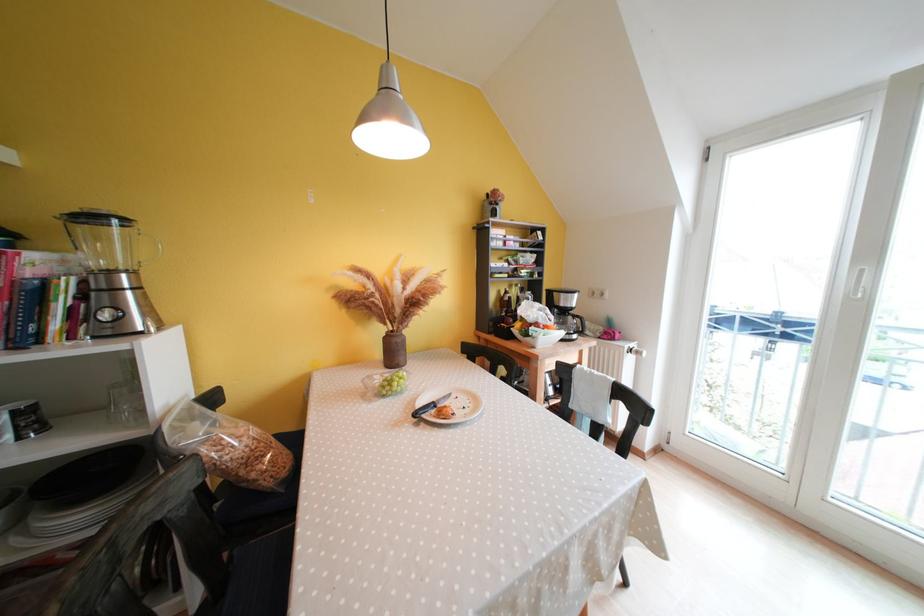
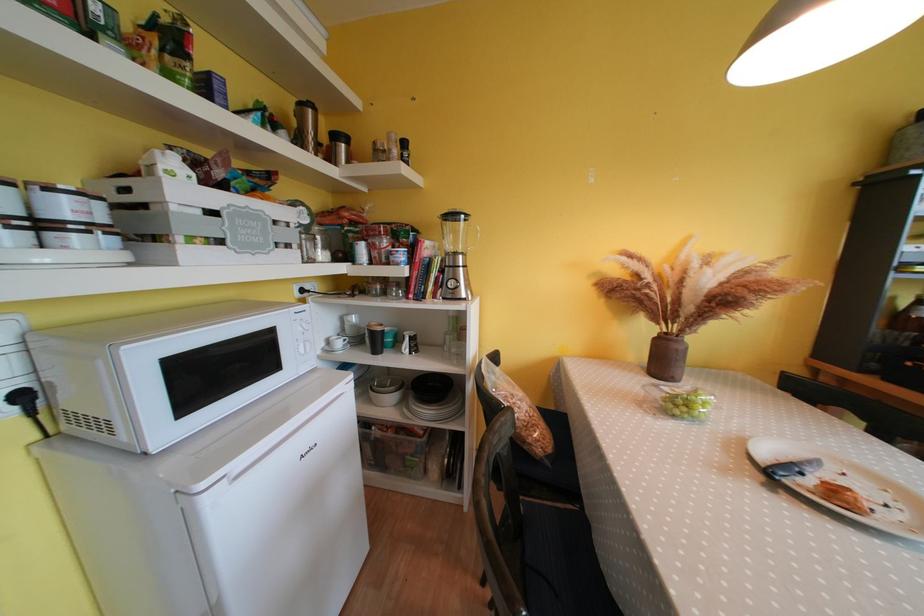
Question: The first image is from the beginning of the video and the second image is from the end. How did the camera likely rotate when shooting the video?

Choices:
 (A) Left
 (B) Right
 (C) Up
 (D) Down

Answer: (A)